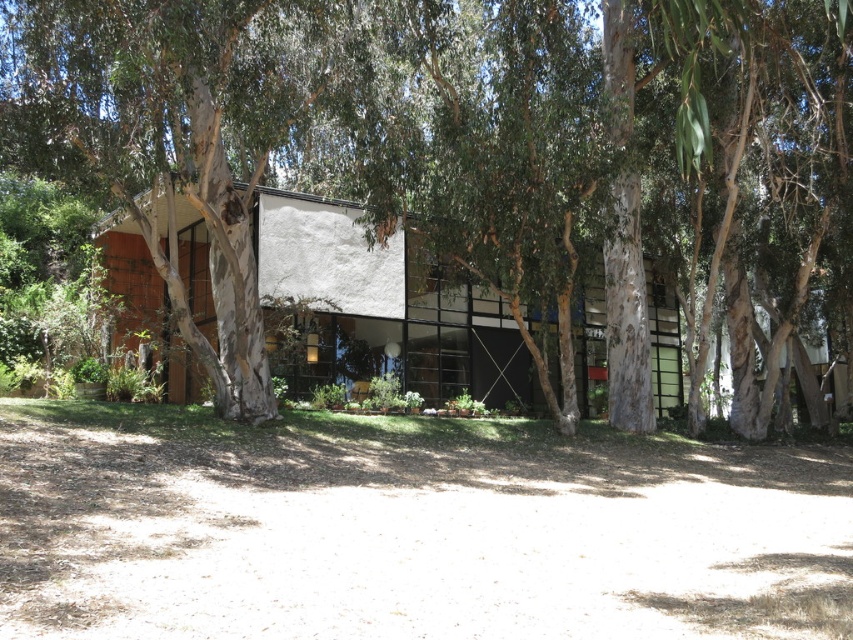
Is point (461, 182) more distant than point (383, 310)?

No, (461, 182) is closer to viewer.

Between point (50, 156) and point (144, 312), which one is positioned behind?

The point (144, 312) is more distant.

You are a GUI agent. You are given a task and a screenshot of the screen. Output one action in this format:
    pyautogui.click(x=<x>, y=<y>)
    Task: Click on the white textured tree at center
    Image resolution: width=853 pixels, height=640 pixels.
    Given the screenshot: What is the action you would take?
    pyautogui.click(x=328, y=113)